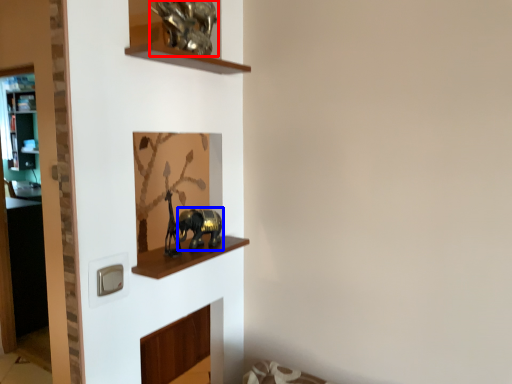
Question: Which object appears closest to the camera in this image, animal (highlighted by a red box) or animal (highlighted by a blue box)?

Choices:
 (A) animal
 (B) animal

Answer: (A)